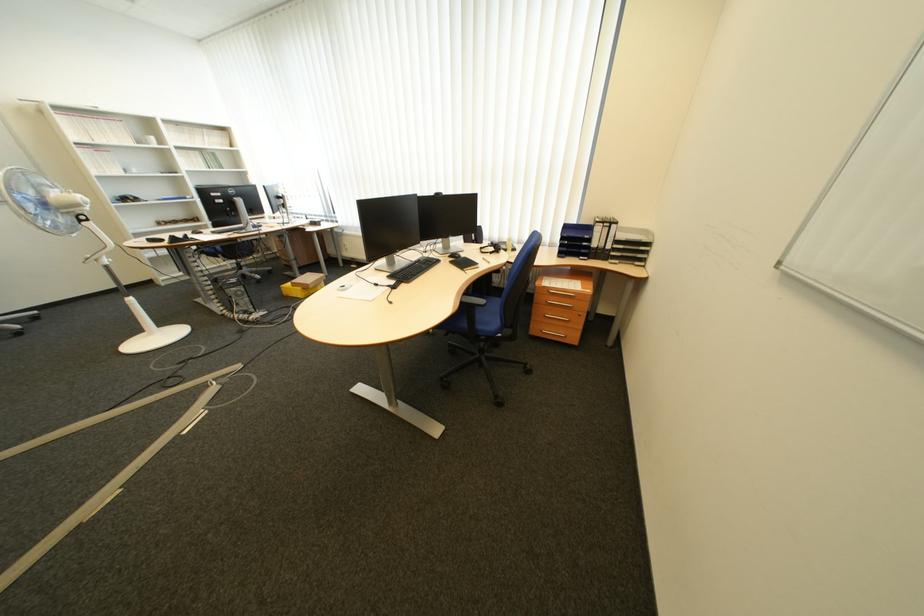
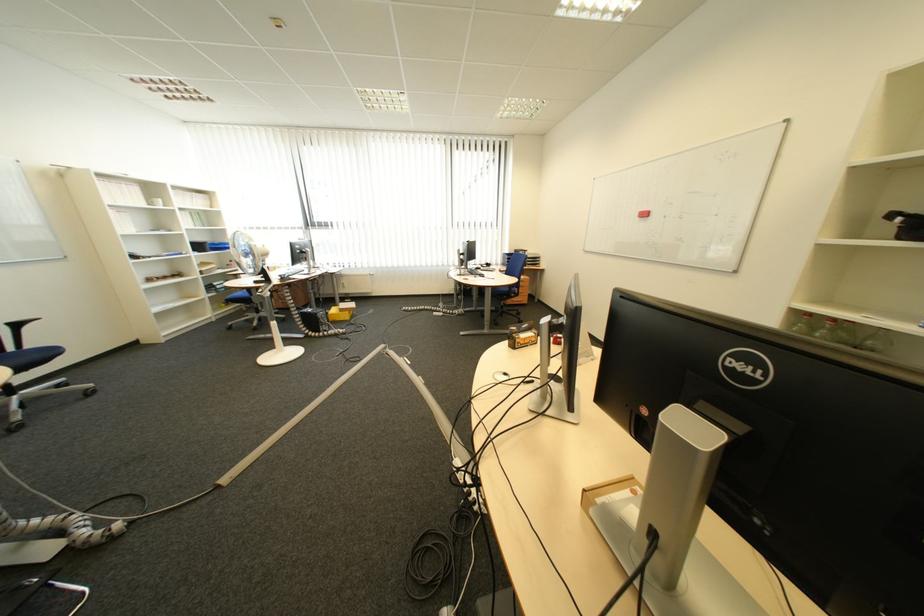
Question: I am providing you with two images of the same scene from different viewpoints. After the viewpoint changes to image2, which objects are now occluded?

Choices:
 (A) glass bottle
 (B) green glass cup
 (C) black keyboard
 (D) red board eraser

Answer: (C)